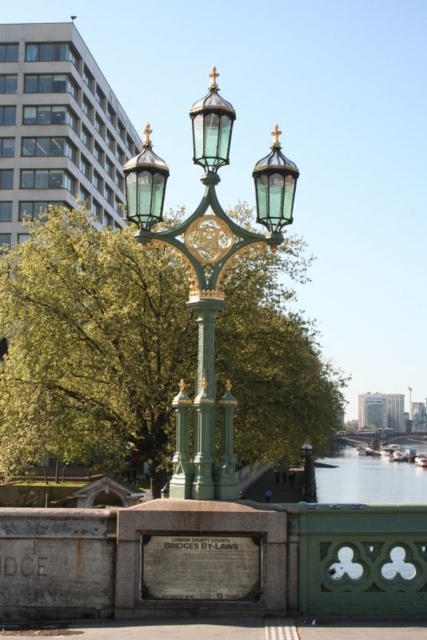
You are a pedestrian walking along the bridge and want to take a photo of the clear water at lower right. Which side of the green polished metal street light at center should you stand to capture the water in the frame?

To capture the clear water at lower right in the frame, you should stand on the right side of the green polished metal street light at center since the water is positioned to the right of the street light.

You are standing on the bridge and want to take a photo of the green glass street light at center. However, there is clear water at lower right in your view. Will the water block your view of the street light?

The green glass street light at center is behind clear water at lower right, so the water will not block your view of the street light as it is positioned behind the water.

You are a photographer standing on the bridge and want to capture both the green leafy tree at center and the clear water at lower right in your shot. Which object will appear larger in the photo?

The green leafy tree at center will appear larger in the photo because it is taller than the clear water at lower right.